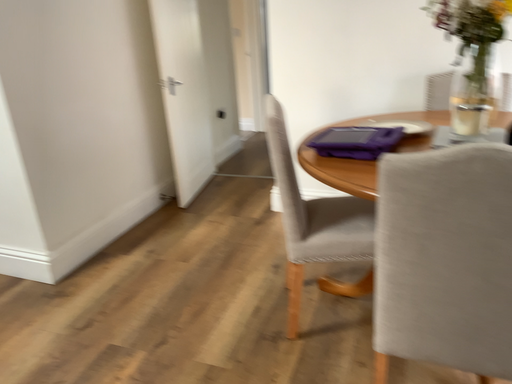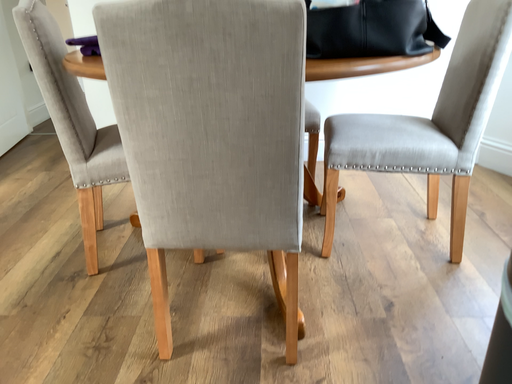
Question: Which way did the camera rotate in the video?

Choices:
 (A) rotated right
 (B) rotated left

Answer: (A)